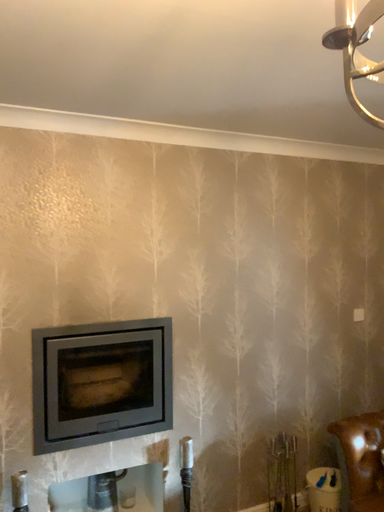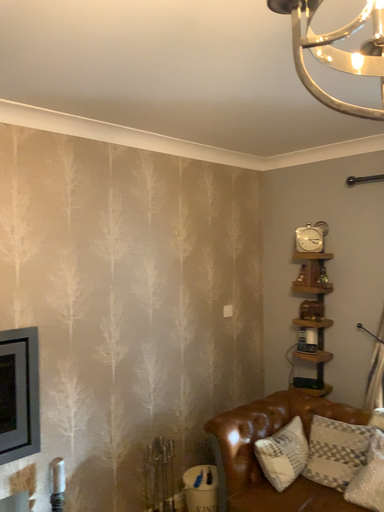
Question: Which way did the camera rotate in the video?

Choices:
 (A) rotated right
 (B) rotated left

Answer: (A)